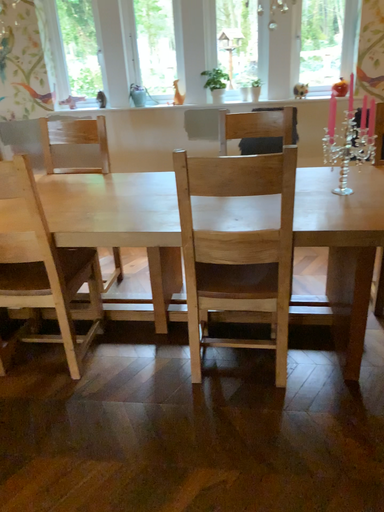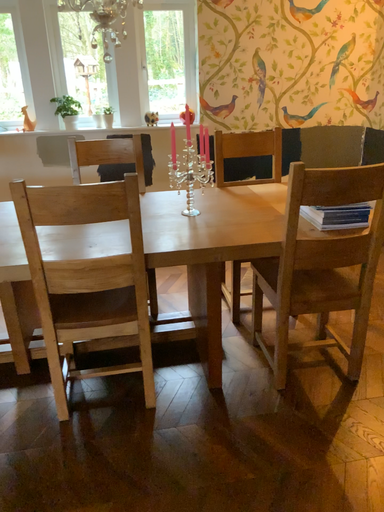
Question: Which way did the camera rotate in the video?

Choices:
 (A) rotated left
 (B) rotated right

Answer: (B)